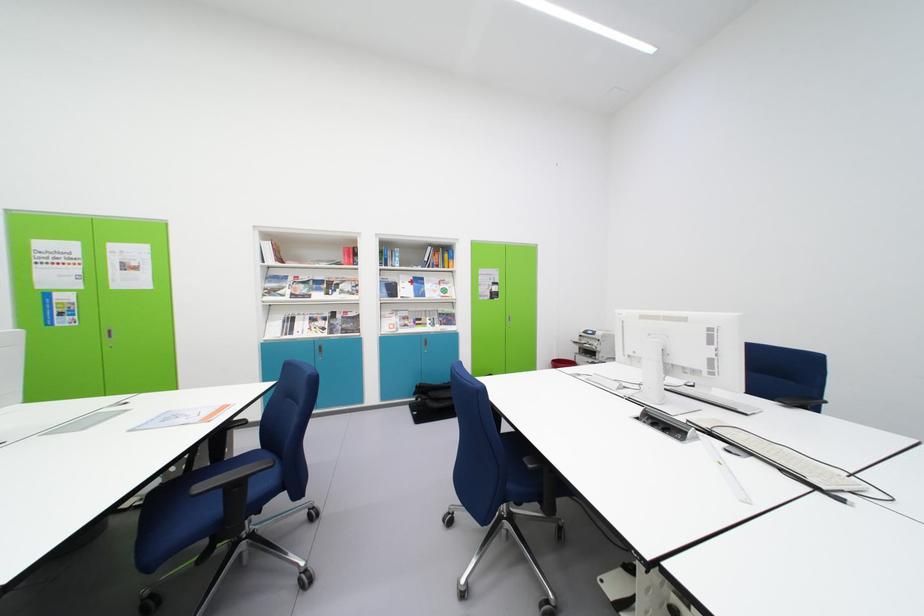
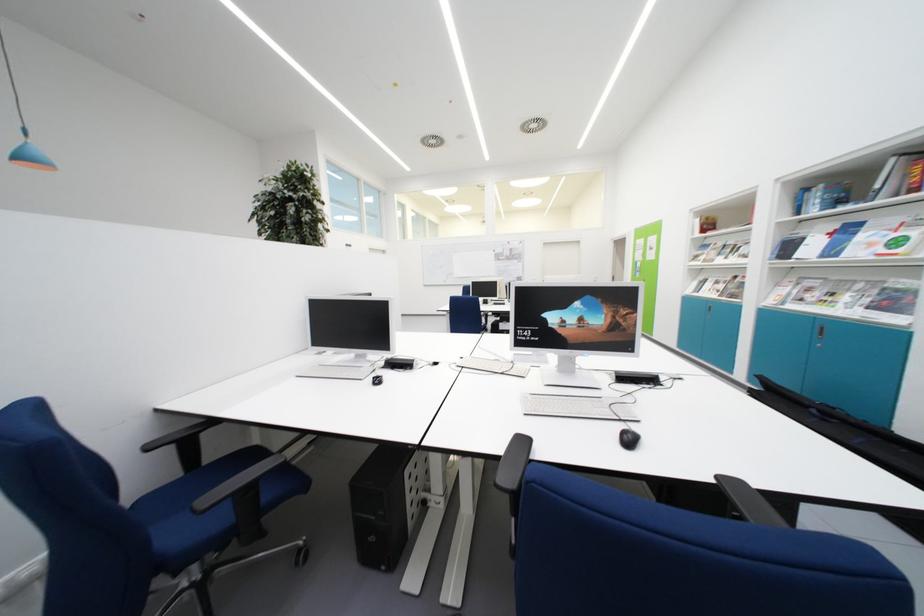
Where in the second image is the point corresponding to the point at 450,318 from the first image?

(903, 294)